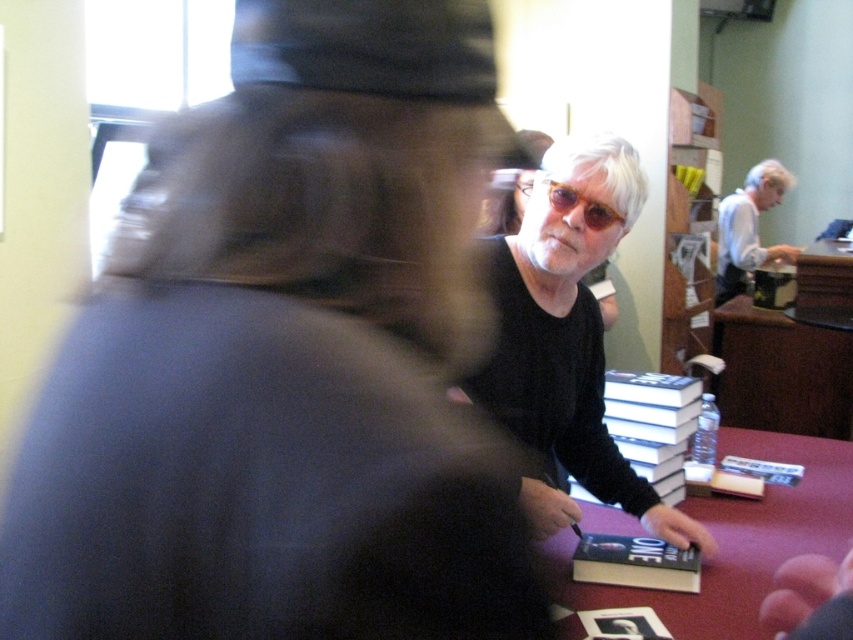
Does white paper at right have a lesser width compared to clear plastic goggles at center?

No.

Who is more distant from viewer, [740,218] or [549,180]?

The point [740,218] is behind.

Locate an element on the screen. white paper at right is located at coordinates (749, 228).

Does white paperback books at center have a lesser height compared to hardcover book at center?

In fact, white paperback books at center may be taller than hardcover book at center.

Is white paperback books at center behind hardcover book at center?

Yes, white paperback books at center is behind hardcover book at center.

Is point (662, 432) closer to viewer compared to point (618, 572)?

No, it is not.

Where is `white paperback books at center`? Image resolution: width=853 pixels, height=640 pixels. white paperback books at center is located at coordinates (651, 419).

Does white paperback books at center have a lesser height compared to clear plastic goggles at center?

In fact, white paperback books at center may be taller than clear plastic goggles at center.

Between white paperback books at center and clear plastic goggles at center, which one appears on the right side from the viewer's perspective?

white paperback books at center

Is point (700, 406) behind point (590, 214)?

Yes.

Where is `white paperback books at center`? white paperback books at center is located at coordinates (651, 419).